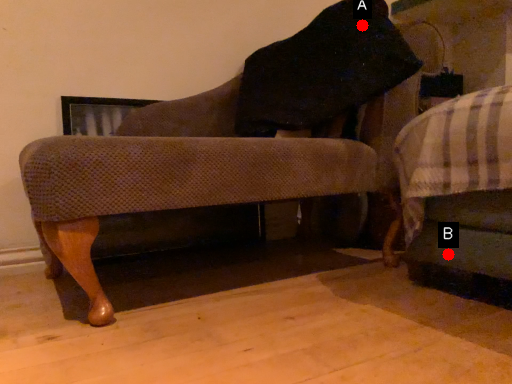
Question: Two points are circled on the image, labeled by A and B beside each circle. Which point is closer to the camera?

Choices:
 (A) A is closer
 (B) B is closer

Answer: (B)